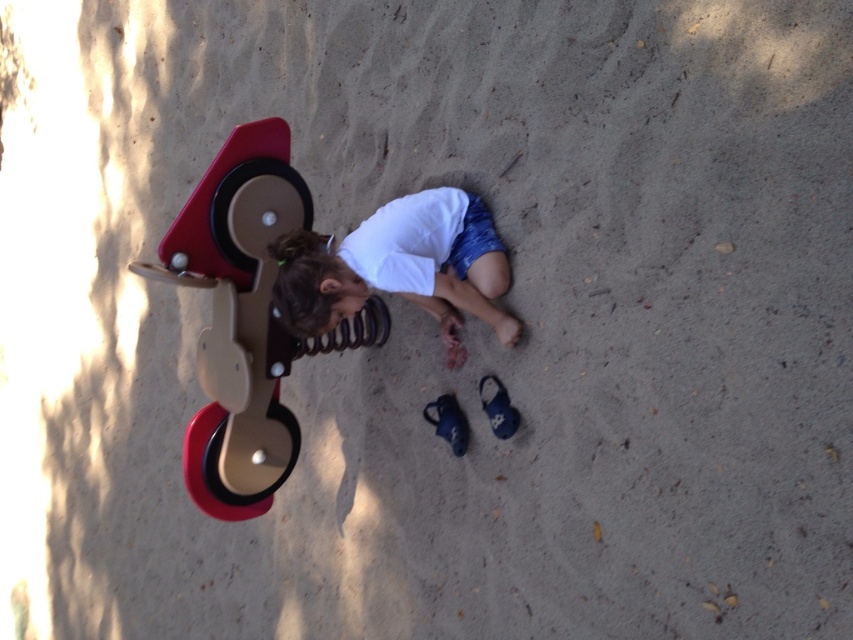
Question: Is beige plastic swing at left bigger than white cotton shirt at center?

Choices:
 (A) no
 (B) yes

Answer: (B)

Question: Which of the following is the farthest from the observer?

Choices:
 (A) (323, 314)
 (B) (444, 440)

Answer: (B)

Question: Which point appears farthest from the camera in this image?

Choices:
 (A) (486, 273)
 (B) (454, 396)

Answer: (B)

Question: Can you confirm if beige plastic swing at left is wider than white cotton shirt at center?

Choices:
 (A) no
 (B) yes

Answer: (A)

Question: Among these points, which one is nearest to the camera?

Choices:
 (A) (436, 433)
 (B) (172, 266)
 (C) (514, 429)

Answer: (C)

Question: Does beige plastic swing at left appear under blue fabric shoe at lower center?

Choices:
 (A) no
 (B) yes

Answer: (A)